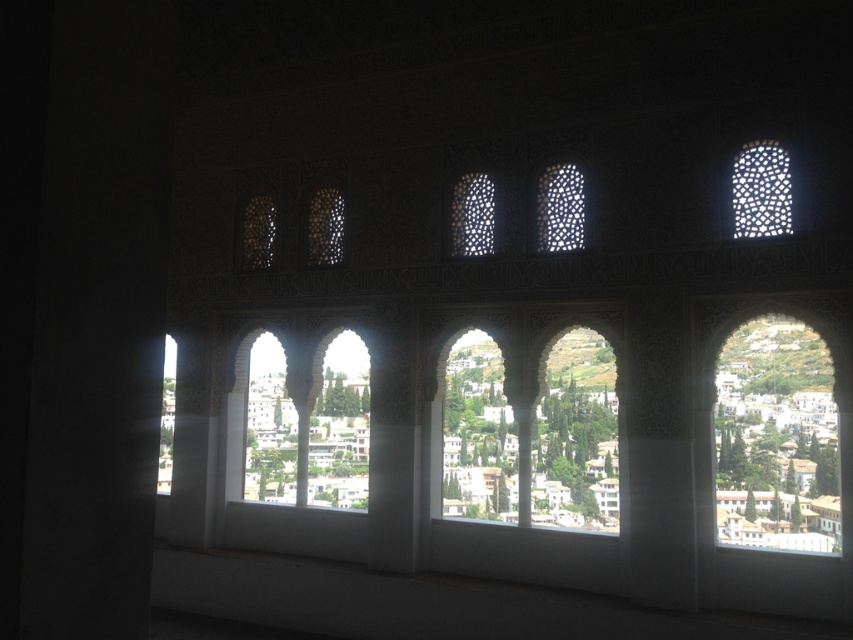
Can you confirm if translucent glass lattice at center is positioned to the right of translucent glass window at center?

Correct, you'll find translucent glass lattice at center to the right of translucent glass window at center.

Who is positioned more to the left, translucent glass lattice at center or translucent glass window at center?

From the viewer's perspective, translucent glass window at center appears more on the left side.

Who is more forward, (543,179) or (456,211)?

Point (543,179) is in front.

Image resolution: width=853 pixels, height=640 pixels. I want to click on translucent glass lattice at center, so click(x=560, y=209).

Is white lattice at upper right closer to the viewer compared to translucent glass lattice at center?

Yes.

Between point (782, 211) and point (577, 232), which one is positioned behind?

The point (577, 232) is more distant.

This screenshot has height=640, width=853. What are the coordinates of `white lattice at upper right` in the screenshot? It's located at (761, 189).

Between point (563, 179) and point (335, 252), which one is positioned in front?

Point (563, 179) is more forward.

Identify the location of translucent glass lattice at center. The image size is (853, 640). (560, 209).